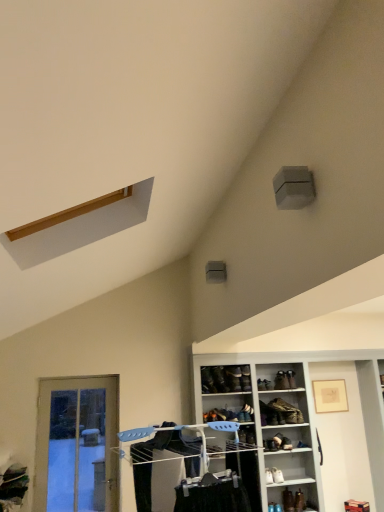
What do you see at coordinates (299, 501) in the screenshot?
I see `leather shoe at lower right, which is counted as the eighth shoe, starting from the top` at bounding box center [299, 501].

The height and width of the screenshot is (512, 384). What do you see at coordinates (77, 444) in the screenshot?
I see `translucent glass door at lower left` at bounding box center [77, 444].

Measure the distance between leather shoe at center, which is the 8th shoe from bottom to top, and camera.

14.74 feet.

Locate an element on the screen. Image resolution: width=384 pixels, height=512 pixels. white leather shoe at lower center, the 3th shoe when ordered from bottom to top is located at coordinates (277, 475).

This screenshot has width=384, height=512. I want to click on white matte shoe rack at center, so click(291, 424).

Is leather shoe at lower right, marked as the 2th shoe in a bottom-to-top arrangement, next to black leather shoe at center, acting as the first shoe starting from the top, and touching it?

leather shoe at lower right, marked as the 2th shoe in a bottom-to-top arrangement, is not next to black leather shoe at center, acting as the first shoe starting from the top, and they're not touching.

Is leather shoe at lower right, marked as the 2th shoe in a bottom-to-top arrangement, completely or partially outside of black leather shoe at center, marked as the ninth shoe in a bottom-to-top arrangement?

leather shoe at lower right, marked as the 2th shoe in a bottom-to-top arrangement, is positioned outside black leather shoe at center, marked as the ninth shoe in a bottom-to-top arrangement.

From a real-world perspective, is leather shoe at lower right, which is counted as the eighth shoe, starting from the top, physically located above or below black leather shoe at center, marked as the ninth shoe in a bottom-to-top arrangement?

In terms of real-world spatial position, leather shoe at lower right, which is counted as the eighth shoe, starting from the top, is below black leather shoe at center, marked as the ninth shoe in a bottom-to-top arrangement.

The height and width of the screenshot is (512, 384). What are the coordinates of `shoe that is the 7th one when counting upward from the leather shoe at lower right, marked as the 2th shoe in a bottom-to-top arrangement (from the image's perspective)` in the screenshot? It's located at (220, 379).

Which of these two, white leather shoe at lower center, the 3th shoe when ordered from bottom to top, or black leather shoe at center, acting as the first shoe starting from the top, is thinner?

Thinner between the two is white leather shoe at lower center, the 3th shoe when ordered from bottom to top.

Based on the photo, which is nearer, (278, 477) or (223, 374)?

The point (278, 477) is more forward.

Can we say white leather shoe at lower center, the 3th shoe when ordered from bottom to top, lies outside black leather shoe at center, marked as the ninth shoe in a bottom-to-top arrangement?

Yes, white leather shoe at lower center, the 3th shoe when ordered from bottom to top, is located beyond the bounds of black leather shoe at center, marked as the ninth shoe in a bottom-to-top arrangement.

Considering the positions of point (99, 383) and point (278, 399), is point (99, 383) closer or farther from the camera than point (278, 399)?

Point (99, 383) is closer to the camera than point (278, 399).

Can you confirm if translucent glass door at lower left is bigger than leather boot at center?

Correct, translucent glass door at lower left is larger in size than leather boot at center.

The width and height of the screenshot is (384, 512). In the image, there is a leather boot at center. Identify the location of screen door below it (from the image's perspective). (77, 444).

Is translucent glass door at lower left not inside leather boot at center?

translucent glass door at lower left is positioned outside leather boot at center.

Consider the image. From a real-world perspective, which is physically below, leather shoe at center, the sixth shoe viewed from the top, or leather shoe at lower right, which is the first shoe in bottom-to-top order?

From a 3D spatial view, leather shoe at lower right, which is the first shoe in bottom-to-top order, is below.

Which is behind, leather shoe at center, the sixth shoe viewed from the top, or leather shoe at lower right, arranged as the ninth shoe when viewed from the top?

leather shoe at center, the sixth shoe viewed from the top, is further from the camera.

From the image's perspective, relative to leather shoe at lower right, which is the first shoe in bottom-to-top order, is leather shoe at center, the sixth shoe viewed from the top, above or below?

Clearly, from the image's perspective, leather shoe at center, the sixth shoe viewed from the top, is above leather shoe at lower right, which is the first shoe in bottom-to-top order.

Is leather shoe at center, the fourth shoe ordered from the bottom, aimed at leather shoe at lower right, which is the first shoe in bottom-to-top order?

→ No.

Choose the correct answer: Is leather shoe at lower right, which is the first shoe in bottom-to-top order, inside leather shoe at lower right, which is counted as the eighth shoe, starting from the top, or outside it?

leather shoe at lower right, which is the first shoe in bottom-to-top order, is outside leather shoe at lower right, which is counted as the eighth shoe, starting from the top.

Based on the photo, is leather shoe at lower right, arranged as the ninth shoe when viewed from the top, beside leather shoe at lower right, which is counted as the eighth shoe, starting from the top?

Yes, leather shoe at lower right, arranged as the ninth shoe when viewed from the top, is with leather shoe at lower right, which is counted as the eighth shoe, starting from the top.

Where is `the 2nd shoe counting from the left side of the leather shoe at lower right, marked as the 2th shoe in a bottom-to-top arrangement`? the 2nd shoe counting from the left side of the leather shoe at lower right, marked as the 2th shoe in a bottom-to-top arrangement is located at coordinates (288, 500).

Considering the sizes of leather shoe at lower right, which is the first shoe in bottom-to-top order, and leather shoe at lower right, marked as the 2th shoe in a bottom-to-top arrangement, in the image, is leather shoe at lower right, which is the first shoe in bottom-to-top order, taller or shorter than leather shoe at lower right, marked as the 2th shoe in a bottom-to-top arrangement,?

Considering their sizes, leather shoe at lower right, which is the first shoe in bottom-to-top order, has less height than leather shoe at lower right, marked as the 2th shoe in a bottom-to-top arrangement.

Is leather boot at center, which is counted as the 6th shoe, starting from the bottom, to the left of leather shoe at lower right, which is the first shoe in bottom-to-top order, from the viewer's perspective?

Indeed, leather boot at center, which is counted as the 6th shoe, starting from the bottom, is positioned on the left side of leather shoe at lower right, which is the first shoe in bottom-to-top order.

Is leather boot at center, which is counted as the 6th shoe, starting from the bottom, turned away from leather shoe at lower right, arranged as the ninth shoe when viewed from the top?

No, leather boot at center, which is counted as the 6th shoe, starting from the bottom, is not facing the opposite direction of leather shoe at lower right, arranged as the ninth shoe when viewed from the top.

From the image's perspective, starting from the leather boot at center, the 4th shoe viewed from the top, which shoe is the 5th one below? Please provide its 2D coordinates.

[(288, 500)]

From the image's perspective, which one is positioned lower, leather boot at center, which is counted as the 6th shoe, starting from the bottom, or leather shoe at lower right, arranged as the ninth shoe when viewed from the top?

leather shoe at lower right, arranged as the ninth shoe when viewed from the top, is shown below in the image.

Is there a large distance between white leather shoe at lower center, the 3th shoe when ordered from bottom to top, and leather shoe at center, placed as the fifth shoe when sorted from bottom to top?

They are positioned close to each other.

In the scene shown: Considering the relative sizes of white leather shoe at lower center, the 7th shoe when ordered from top to bottom, and leather shoe at center, the fifth shoe in the top-to-bottom sequence, in the image provided, is white leather shoe at lower center, the 7th shoe when ordered from top to bottom, thinner than leather shoe at center, the fifth shoe in the top-to-bottom sequence,?

In fact, white leather shoe at lower center, the 7th shoe when ordered from top to bottom, might be wider than leather shoe at center, the fifth shoe in the top-to-bottom sequence.

Is white leather shoe at lower center, the 7th shoe when ordered from top to bottom, spatially inside leather shoe at center, the fifth shoe in the top-to-bottom sequence, or outside of it?

white leather shoe at lower center, the 7th shoe when ordered from top to bottom, is outside leather shoe at center, the fifth shoe in the top-to-bottom sequence.

From a real-world perspective, is white leather shoe at lower center, the 3th shoe when ordered from bottom to top, located beneath leather shoe at center, the fifth shoe in the top-to-bottom sequence?

Yes.

Where is `the 7th shoe located above the leather shoe at lower right, which is counted as the eighth shoe, starting from the top (from a real-world perspective)`? The height and width of the screenshot is (512, 384). the 7th shoe located above the leather shoe at lower right, which is counted as the eighth shoe, starting from the top (from a real-world perspective) is located at coordinates (220, 379).

I want to click on the 6th shoe above when counting from the white leather shoe at lower center, the 3th shoe when ordered from bottom to top (from the image's perspective), so click(x=220, y=379).

Estimate the real-world distances between objects in this image. Which object is further from leather shoe at center, which is the 8th shoe from bottom to top, matte plastic clothes rack at center or leather shoe at center, the 7th shoe when ordered from bottom to top?

matte plastic clothes rack at center is positioned further to the anchor leather shoe at center, which is the 8th shoe from bottom to top.

Which object lies nearer to the anchor point leather shoe at center, the fifth shoe in the top-to-bottom sequence, leather shoe at lower right, marked as the 2th shoe in a bottom-to-top arrangement, or leather shoe at center, the sixth shoe viewed from the top?

leather shoe at center, the sixth shoe viewed from the top, is closer to leather shoe at center, the fifth shoe in the top-to-bottom sequence.

From the image, which object appears to be nearer to leather shoe at center, placed as the 2th shoe when sorted from top to bottom, leather shoe at lower right, marked as the 2th shoe in a bottom-to-top arrangement, or white matte shoe rack at center?

Among the two, white matte shoe rack at center is located nearer to leather shoe at center, placed as the 2th shoe when sorted from top to bottom.

Which object lies further to the anchor point leather shoe at center, the 7th shoe when ordered from bottom to top, leather shoe at lower right, marked as the 2th shoe in a bottom-to-top arrangement, or leather shoe at center, the fourth shoe ordered from the bottom?

leather shoe at lower right, marked as the 2th shoe in a bottom-to-top arrangement, is further to leather shoe at center, the 7th shoe when ordered from bottom to top.

Estimate the real-world distances between objects in this image. Which object is further from translucent glass door at lower left, black leather shoe at center, acting as the first shoe starting from the top, or white matte shoe rack at center?

black leather shoe at center, acting as the first shoe starting from the top, is further to translucent glass door at lower left.

Estimate the real-world distances between objects in this image. Which object is further from black leather shoe at center, marked as the ninth shoe in a bottom-to-top arrangement, matte plastic clothes rack at center or leather boot at center, the 4th shoe viewed from the top?

matte plastic clothes rack at center lies further to black leather shoe at center, marked as the ninth shoe in a bottom-to-top arrangement, than the other object.

From the image, which object appears to be farther from leather shoe at center, arranged as the 3th shoe when viewed from the top, black leather shoe at center, acting as the first shoe starting from the top, or leather boot at center?

leather boot at center is positioned further to the anchor leather shoe at center, arranged as the 3th shoe when viewed from the top.

Considering their positions, is leather shoe at center, the sixth shoe viewed from the top, positioned closer to white leather shoe at lower center, the 3th shoe when ordered from bottom to top, than leather shoe at lower right, marked as the 2th shoe in a bottom-to-top arrangement?

leather shoe at center, the sixth shoe viewed from the top.

This screenshot has width=384, height=512. Identify the location of shoe that lies between leather shoe at center, the fourth shoe ordered from the bottom, and leather shoe at lower right, marked as the 2th shoe in a bottom-to-top arrangement, from top to bottom. (277, 475).

Where is `footwear situated between translucent glass door at lower left and white matte shoe rack at center from left to right`? The width and height of the screenshot is (384, 512). footwear situated between translucent glass door at lower left and white matte shoe rack at center from left to right is located at coordinates (279, 413).

Image resolution: width=384 pixels, height=512 pixels. I want to click on shelf located between matte plastic clothes rack at center and leather shoe at lower right, marked as the 2th shoe in a bottom-to-top arrangement, in the depth direction, so tap(291, 424).

This screenshot has height=512, width=384. What are the coordinates of `shelf between matte plastic clothes rack at center and leather shoe at center, the 7th shoe when ordered from bottom to top, from front to back` in the screenshot? It's located at (291, 424).